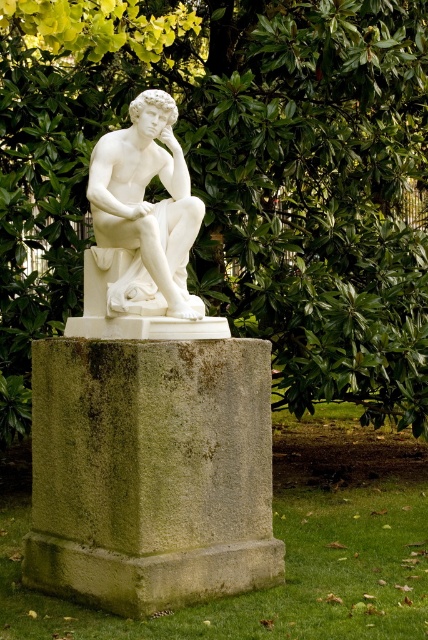
Between green leafy tree at upper center and green stone pedestal at center, which one has less height?

green leafy tree at upper center is shorter.

The width and height of the screenshot is (428, 640). What do you see at coordinates (235, 180) in the screenshot?
I see `green leafy tree at upper center` at bounding box center [235, 180].

Where is `green leafy tree at upper center`? Image resolution: width=428 pixels, height=640 pixels. green leafy tree at upper center is located at coordinates (235, 180).

Is green leafy tree at upper center to the left of white marble statue at center from the viewer's perspective?

Incorrect, green leafy tree at upper center is not on the left side of white marble statue at center.

Is point (362, 141) positioned before point (149, 93)?

No.

Does point (20, 381) come farther from viewer compared to point (127, 202)?

Yes, point (20, 381) is farther from viewer.

Where is `green leafy tree at upper center`? The width and height of the screenshot is (428, 640). green leafy tree at upper center is located at coordinates (235, 180).

Does point (26, 556) come in front of point (136, 298)?

No.

Who is positioned more to the left, green stone pedestal at center or white marble statue at center?

From the viewer's perspective, green stone pedestal at center appears more on the left side.

Is point (232, 438) more distant than point (103, 182)?

No, (232, 438) is in front of (103, 182).

Image resolution: width=428 pixels, height=640 pixels. Find the location of `green stone pedestal at center`. green stone pedestal at center is located at coordinates (151, 472).